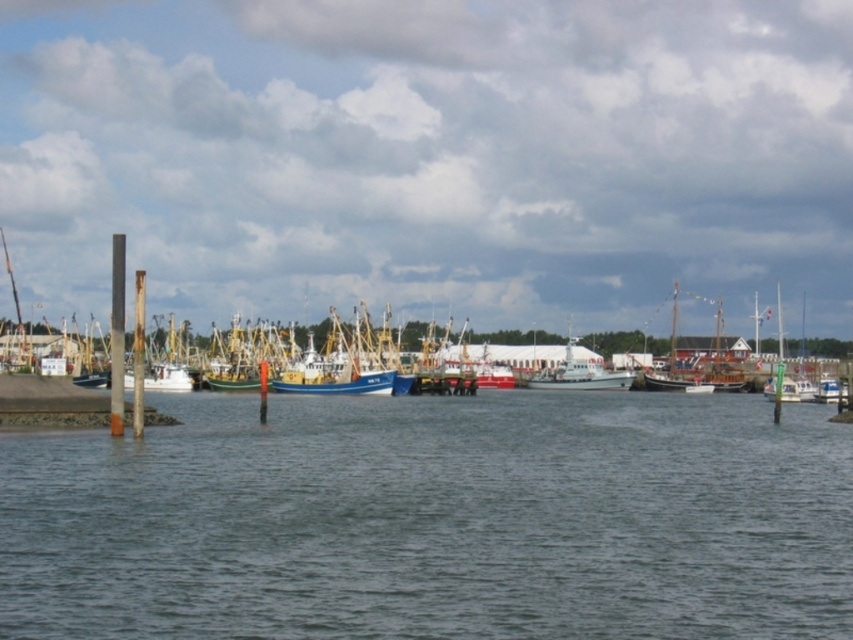
Does point (589, 369) come behind point (349, 371)?

Yes, it is behind point (349, 371).

Who is higher up, white matte boat at center or blue matte boat at center?

white matte boat at center is above.

Does point (614, 388) come farther from viewer compared to point (303, 388)?

Yes.

Identify the location of white matte boat at center. (579, 372).

Between clear water at center and blue matte boat at center, which one appears on the left side from the viewer's perspective?

From the viewer's perspective, blue matte boat at center appears more on the left side.

Can you confirm if clear water at center is positioned to the left of blue matte boat at center?

In fact, clear water at center is to the right of blue matte boat at center.

Locate an element on the screen. clear water at center is located at coordinates (434, 518).

Which is below, clear water at center or white matte boat at center?

clear water at center

Does clear water at center appear over white matte boat at center?

No.

Between point (683, 524) and point (573, 369), which one is positioned in front?

Point (683, 524) is more forward.

The height and width of the screenshot is (640, 853). I want to click on clear water at center, so click(434, 518).